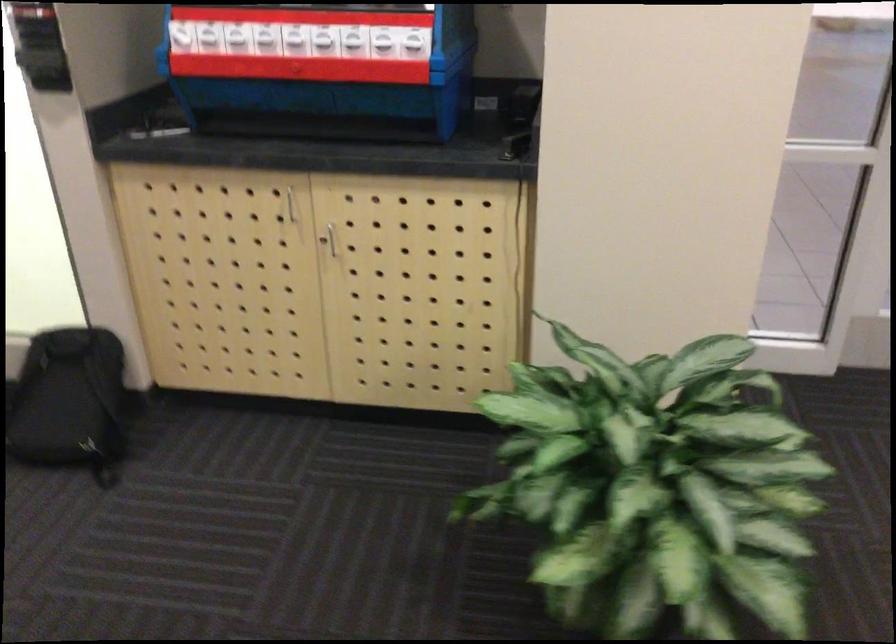
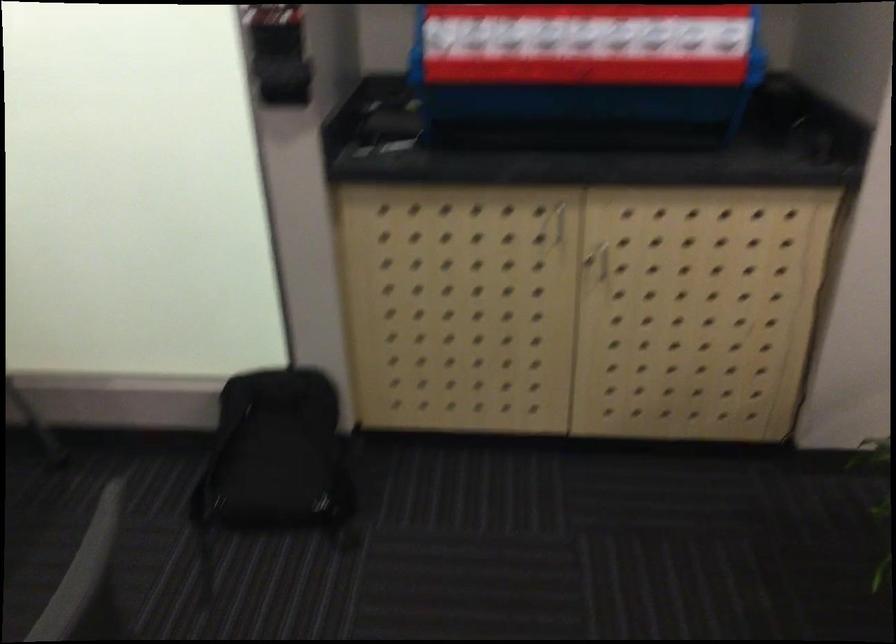
Locate, in the second image, the point that corresponds to the point at 290,207 in the first image.

(558, 223)